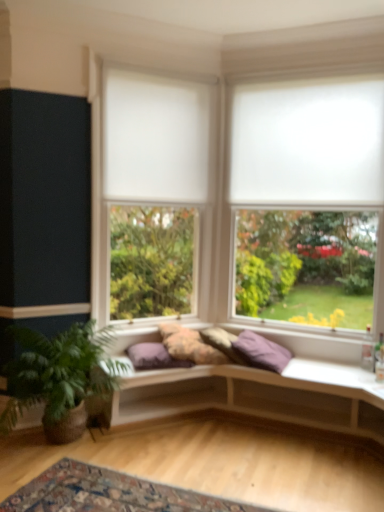
Where is `free area below green leafy plant at lower left (from a real-world perspective)`? Image resolution: width=384 pixels, height=512 pixels. free area below green leafy plant at lower left (from a real-world perspective) is located at coordinates (49, 449).